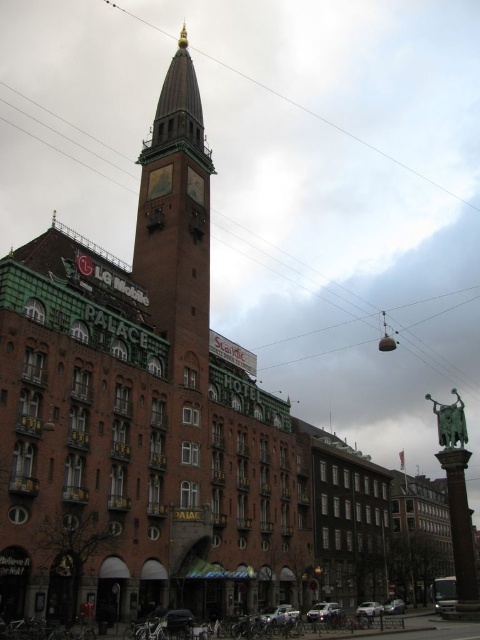
You are standing in front of the historic building and notice the brick steeple at center and the brown wooden power line at upper center. Which object is closer to you?

The brick steeple at center is closer to you because it is in front of the brown wooden power line at upper center.

You are standing in front of the historic LeMobile Palace building and want to locate the brown wooden pole at center. Based on the coordinates provided, where exactly should you look to find it?

The brown wooden pole at center is located at the 2D coordinates point (337, 296).

You are an architect inspecting the clock tower of the historic building. You notice two clocks on the tower. The first is labeled as the gold textured clock at upper center, and the second is the gold metallic clock at upper center. Which of these two clocks is smaller in size?

The gold textured clock at upper center is smaller in size compared to the gold metallic clock at upper center.